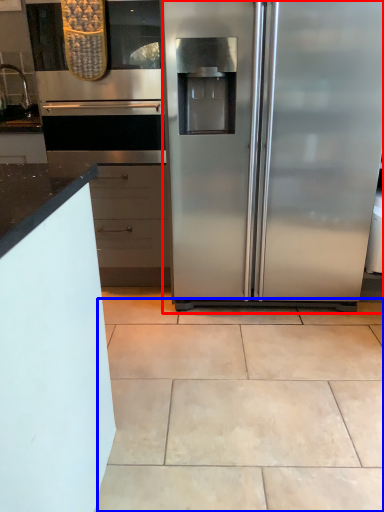
Question: Which object appears closest to the camera in this image, refrigerator (highlighted by a red box) or ceramic tile (highlighted by a blue box)?

Choices:
 (A) refrigerator
 (B) ceramic tile

Answer: (B)